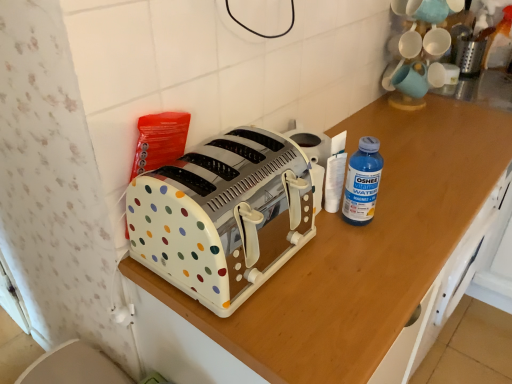
Question: Is white plastic toaster at center at the back of white polka dot plastic toaster at center?

Choices:
 (A) yes
 (B) no

Answer: (B)

Question: Considering the relative sizes of white polka dot plastic toaster at center and white plastic toaster at center in the image provided, is white polka dot plastic toaster at center wider than white plastic toaster at center?

Choices:
 (A) no
 (B) yes

Answer: (A)

Question: Is white polka dot plastic toaster at center shorter than white plastic toaster at center?

Choices:
 (A) yes
 (B) no

Answer: (A)

Question: Is the position of white polka dot plastic toaster at center more distant than that of white plastic toaster at center?

Choices:
 (A) no
 (B) yes

Answer: (B)

Question: From the image's perspective, would you say white polka dot plastic toaster at center is positioned over white plastic toaster at center?

Choices:
 (A) no
 (B) yes

Answer: (B)

Question: Is white polka dot plastic toaster at center not within white plastic toaster at center?

Choices:
 (A) yes
 (B) no

Answer: (A)

Question: From the image's perspective, is metallic silver grater at upper right on blue plastic bottle at right?

Choices:
 (A) yes
 (B) no

Answer: (A)

Question: Is metallic silver grater at upper right to the left of blue plastic bottle at right from the viewer's perspective?

Choices:
 (A) yes
 (B) no

Answer: (B)

Question: Can you confirm if metallic silver grater at upper right is positioned to the right of blue plastic bottle at right?

Choices:
 (A) no
 (B) yes

Answer: (B)

Question: Is metallic silver grater at upper right outside of blue plastic bottle at right?

Choices:
 (A) no
 (B) yes

Answer: (B)

Question: Is blue plastic bottle at right inside metallic silver grater at upper right?

Choices:
 (A) yes
 (B) no

Answer: (B)

Question: Does metallic silver grater at upper right have a greater width compared to blue plastic bottle at right?

Choices:
 (A) no
 (B) yes

Answer: (B)

Question: Does white polka dot plastic toaster at center have a lesser height compared to metallic silver grater at upper right?

Choices:
 (A) no
 (B) yes

Answer: (A)